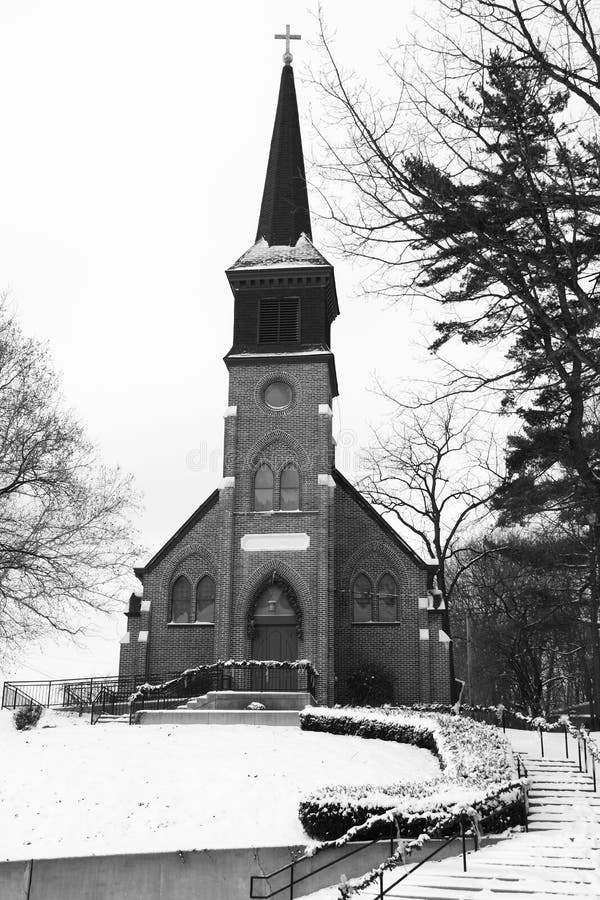
Find the location of a particular element. Image resolution: width=600 pixels, height=900 pixels. garland is located at coordinates point(388,867).